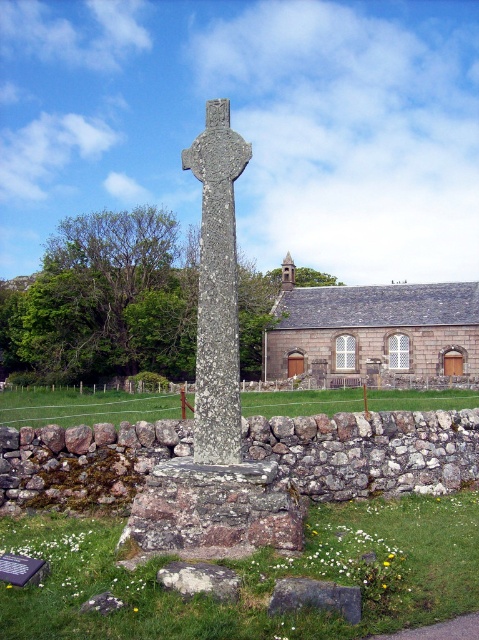
Is granite cross at center smaller than gray stone church at center?

Indeed, granite cross at center has a smaller size compared to gray stone church at center.

Can you confirm if granite cross at center is positioned below gray stone church at center?

No.

I want to click on granite cross at center, so click(x=216, y=397).

Locate an element on the screen. The image size is (479, 640). granite cross at center is located at coordinates (216, 397).

Can you confirm if granite cross at center is smaller than gray rough stone at lower center?

Incorrect, granite cross at center is not smaller in size than gray rough stone at lower center.

Describe the element at coordinates (216, 397) in the screenshot. I see `granite cross at center` at that location.

Is point (216, 298) positioned before point (271, 611)?

No.

Where is `granite cross at center`? granite cross at center is located at coordinates (216, 397).

Is point (206, 394) positioned behind point (296, 577)?

Yes.

Is rough stone cross at center bigger than gray rough stone at lower center?

Yes, rough stone cross at center is bigger than gray rough stone at lower center.

At what (x,y) coordinates should I click in order to perform the action: click on rough stone cross at center. Please return your answer as a coordinate pair (x, y). This screenshot has height=640, width=479. Looking at the image, I should click on (216, 289).

Find the location of a particular element. rough stone cross at center is located at coordinates (216, 289).